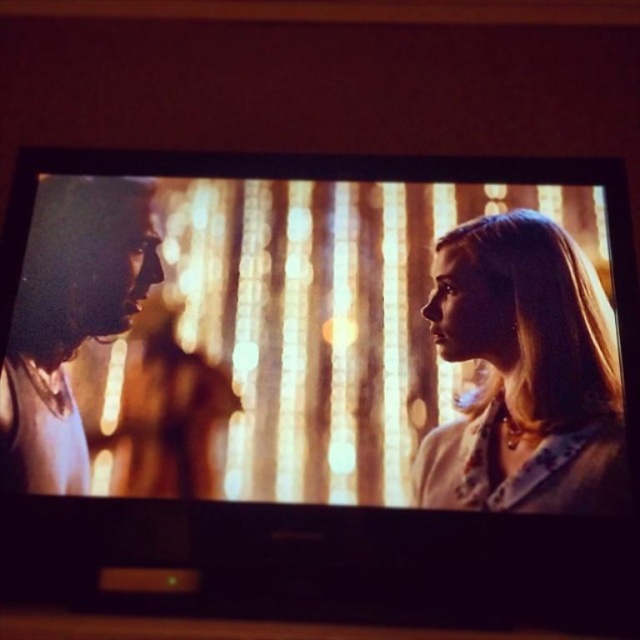
Does blonde hair at right have a lesser height compared to smooth blonde hair at left?

Yes.

Consider the image. How distant is blonde hair at right from smooth blonde hair at left?

A distance of 24.84 inches exists between blonde hair at right and smooth blonde hair at left.

Is point (518, 342) positioned in front of point (60, 266)?

Yes, it is.

Where is `blonde hair at right`? This screenshot has width=640, height=640. blonde hair at right is located at coordinates (524, 374).